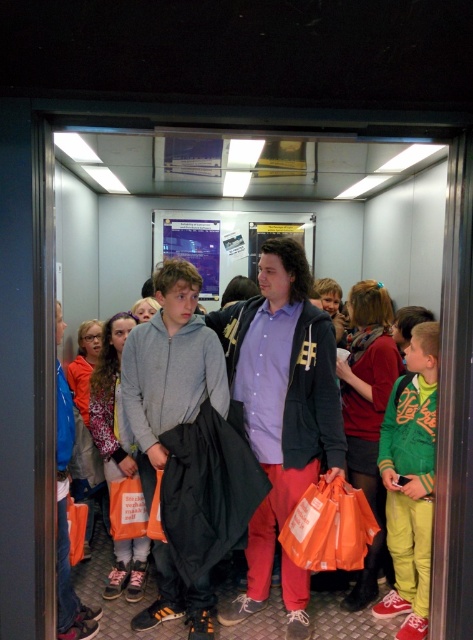
You are standing in the elevator and want to reach the two points marked in the scene. Which point, point (342, 604) or point (80, 442), is closer to you?

Point (342, 604) is closer to the viewer than point (80, 442).

You are standing in the elevator and need to reach the green fleece jacket at right. Given that the elevator walls are at coordinates from 0 to 1 on both axes, can you estimate if the jacket is closer to the right wall or the left wall?

The green fleece jacket at right is located at point 0.753 on the x and y axis, so it is closer to the right wall since 0.753 is closer to 1 than to 0.